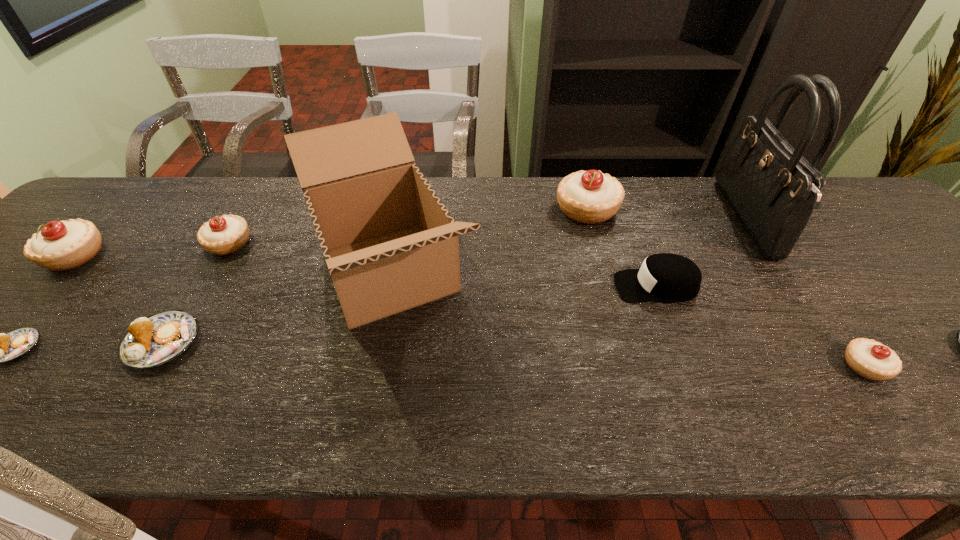
I want to click on object at the left edge, so click(x=60, y=245).

This screenshot has height=540, width=960. In the image, there is a desktop. In order to click on free space at the far edge in this screenshot , I will do `click(656, 205)`.

In order to click on free location at the near edge of the desktop in this screenshot , I will do `click(910, 426)`.

This screenshot has width=960, height=540. Identify the location of vacant region at the left edge of the desktop. (12, 293).

Where is `vacant region at the right edge of the desktop`? vacant region at the right edge of the desktop is located at coordinates (907, 256).

Identify the location of blank region between the sixth object from right to left and the biggest beige pastry. (488, 241).

Find the location of a particular element. This screenshot has width=960, height=540. vacant space that's between the third beige pastry from right to left and the nearest beige pastry is located at coordinates (547, 305).

The width and height of the screenshot is (960, 540). What are the coordinates of `empty space that is in between the black handbag and the cap` in the screenshot? It's located at (701, 253).

Image resolution: width=960 pixels, height=540 pixels. I want to click on free space that is in between the box and the tallest object, so click(568, 246).

Locate which object is the fourth closest to the biggest beige pastry. Please provide its 2D coordinates. Your answer should be formatted as a tuple, i.e. [(x, y)], where the tuple contains the x and y coordinates of a point satisfying the conditions above.

[(870, 359)]